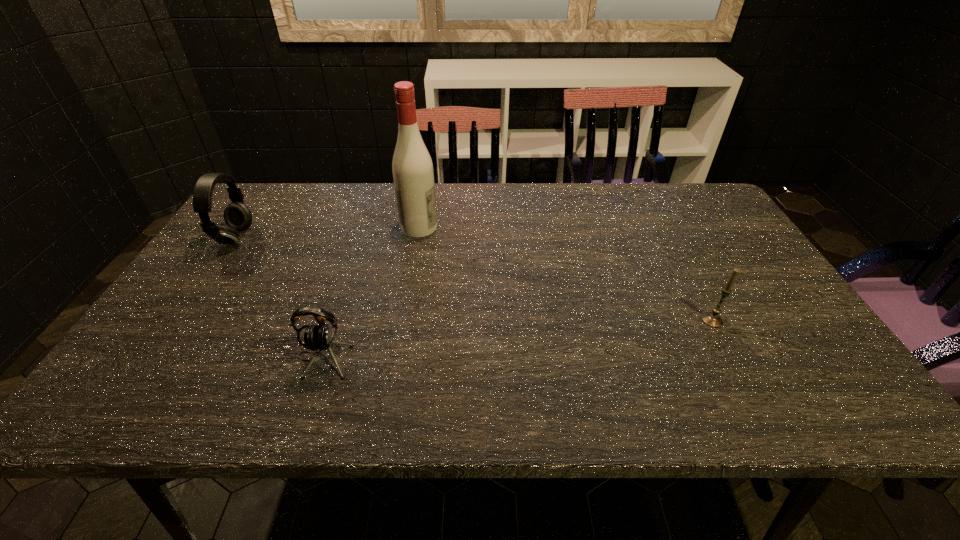
Find the location of a particular element. the tallest object is located at coordinates (412, 168).

Where is `alcohol`? alcohol is located at coordinates (412, 168).

Locate an element on the screen. The image size is (960, 540). the third shortest object is located at coordinates (237, 216).

This screenshot has width=960, height=540. Identify the location of the left earphone. tap(237, 216).

Where is `the third object from right to left`? The height and width of the screenshot is (540, 960). the third object from right to left is located at coordinates (320, 337).

This screenshot has height=540, width=960. Find the location of `the nearest object`. the nearest object is located at coordinates (320, 337).

The image size is (960, 540). Find the location of `the third farthest object`. the third farthest object is located at coordinates (712, 319).

You are a GUI agent. You are given a task and a screenshot of the screen. Output one action in this format:
    pyautogui.click(x=<x>, y=<y>)
    Task: Click on the rightmost object
    The image size is (960, 540).
    Given the screenshot: What is the action you would take?
    pyautogui.click(x=712, y=319)

Find the location of a particular element. This screenshot has width=960, height=540. free point located on the label of the tallest object is located at coordinates (521, 227).

The image size is (960, 540). What are the coordinates of `free spot located on the ear cups of the farther earphone` in the screenshot? It's located at (360, 239).